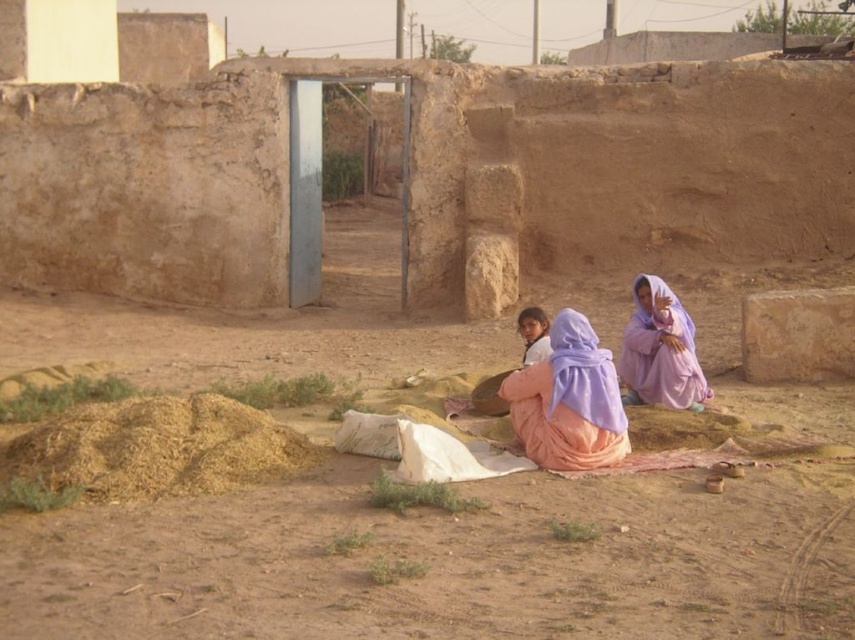
Looking at this image, does purple fabric child at center have a greater height compared to purple fabric at right?

Yes, purple fabric child at center is taller than purple fabric at right.

Who is more forward, (557, 420) or (626, 387)?

Point (557, 420)

This screenshot has width=855, height=640. Describe the element at coordinates (568, 401) in the screenshot. I see `purple fabric child at center` at that location.

Image resolution: width=855 pixels, height=640 pixels. In order to click on purple fabric child at center in this screenshot , I will do `click(568, 401)`.